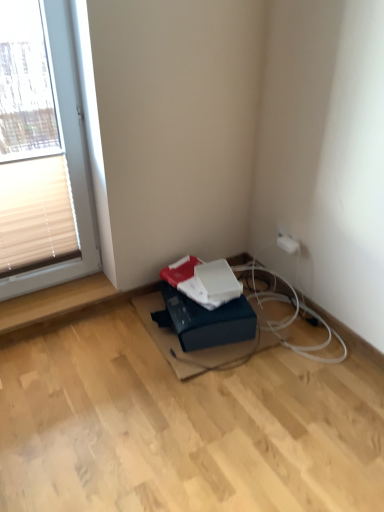
Question: From the image's perspective, is white plastic window at upper left located beneath black rubber cable at lower center?

Choices:
 (A) no
 (B) yes

Answer: (A)

Question: Can you confirm if white plastic window at upper left is wider than black rubber cable at lower center?

Choices:
 (A) no
 (B) yes

Answer: (A)

Question: From the image's perspective, is white plastic window at upper left on top of black rubber cable at lower center?

Choices:
 (A) no
 (B) yes

Answer: (B)

Question: Is white plastic window at upper left positioned beyond the bounds of black rubber cable at lower center?

Choices:
 (A) no
 (B) yes

Answer: (B)

Question: Does white plastic window at upper left have a lesser height compared to black rubber cable at lower center?

Choices:
 (A) yes
 (B) no

Answer: (B)

Question: Could black rubber cable at lower center be considered to be inside white plastic window at upper left?

Choices:
 (A) no
 (B) yes

Answer: (A)

Question: Can you confirm if white plastic electric outlet at upper right is wider than beige fabric blind at left?

Choices:
 (A) yes
 (B) no

Answer: (A)

Question: Does white plastic electric outlet at upper right turn towards beige fabric blind at left?

Choices:
 (A) no
 (B) yes

Answer: (A)

Question: Is white plastic electric outlet at upper right shorter than beige fabric blind at left?

Choices:
 (A) no
 (B) yes

Answer: (B)

Question: Considering the relative sizes of white plastic electric outlet at upper right and beige fabric blind at left in the image provided, is white plastic electric outlet at upper right thinner than beige fabric blind at left?

Choices:
 (A) yes
 (B) no

Answer: (B)

Question: Is white plastic electric outlet at upper right closer to camera compared to beige fabric blind at left?

Choices:
 (A) no
 (B) yes

Answer: (A)

Question: Is beige fabric blind at left located within white plastic electric outlet at upper right?

Choices:
 (A) yes
 (B) no

Answer: (B)

Question: Is blue cardboard box at lower center looking in the opposite direction of white plastic electric outlet at upper right?

Choices:
 (A) yes
 (B) no

Answer: (B)